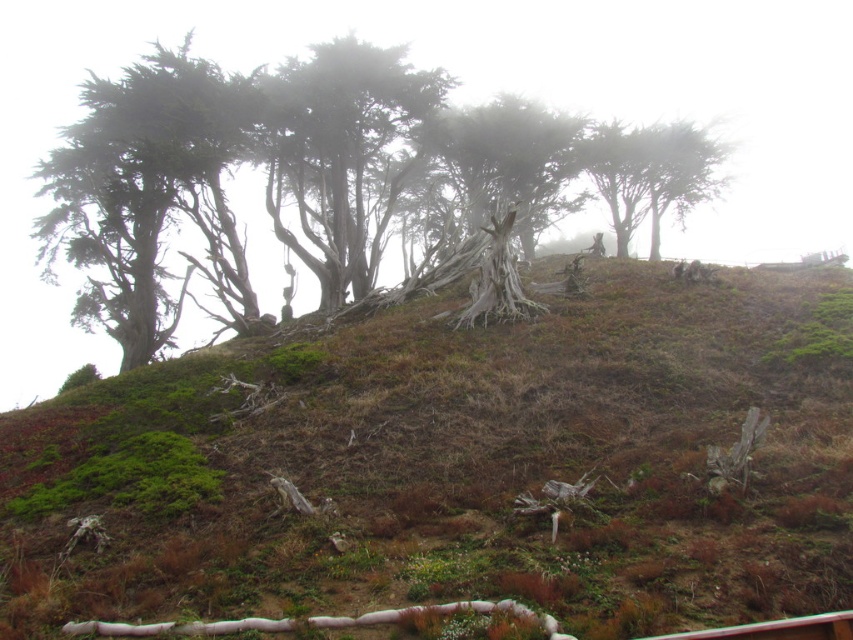
Question: Considering the real-world distances, which object is closest to the green textured tree at left?

Choices:
 (A) green mossy hillside at upper center
 (B) gray bark tree at center

Answer: (B)

Question: Which object is the farthest from the green mossy hillside at upper center?

Choices:
 (A) green textured tree at left
 (B) gray bark tree at center
 (C) smooth gray bark trees at center

Answer: (B)

Question: Which point is farther from the camera taking this photo?

Choices:
 (A) (519, 179)
 (B) (91, 145)
 (C) (256, 474)
 (D) (338, 300)

Answer: (A)

Question: Is the position of green textured tree at left less distant than that of gray bark tree at center?

Choices:
 (A) yes
 (B) no

Answer: (A)

Question: From the image, what is the correct spatial relationship of smooth gray bark trees at center in relation to green textured tree at left?

Choices:
 (A) above
 (B) below

Answer: (A)

Question: Is smooth gray bark trees at center to the right of gray bark tree at center from the viewer's perspective?

Choices:
 (A) yes
 (B) no

Answer: (B)